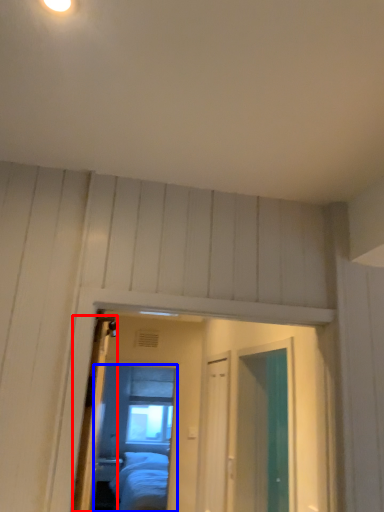
Question: Among these objects, which one is nearest to the camera, door (highlighted by a red box) or mirror (highlighted by a blue box)?

Choices:
 (A) door
 (B) mirror

Answer: (A)